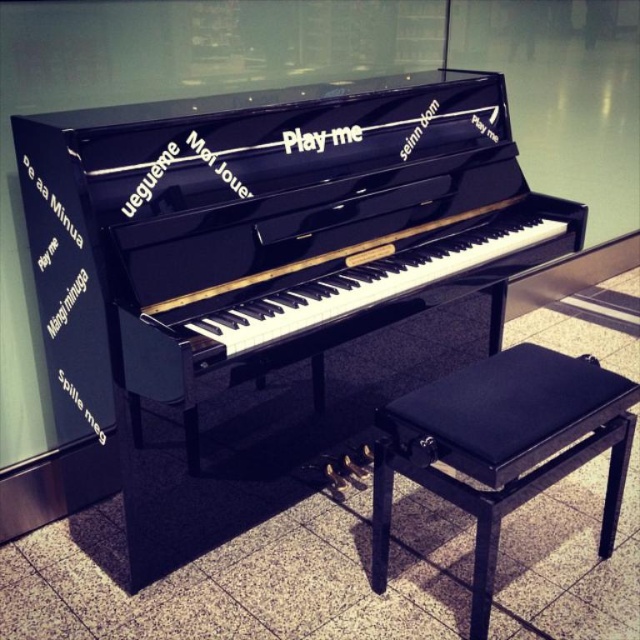
You are a person wanting to sit on the black leather music stool at center to play the piano. Where is the black leather footrest at lower center located in relation to the stool?

The black leather footrest at lower center is located behind the black leather music stool at center.

You are a person who is 1.8 meters tall and wants to play the piano. The black leather footrest at lower center is positioned 1.33 meters away from the piano. Can you comfortably reach the footrest while sitting at the piano?

The black leather footrest at lower center is 1.33 meters away from the piano. A person who is 1.8 meters tall can comfortably reach the footrest while sitting at the piano since the distance is within a typical comfortable reach range for someone of that height.